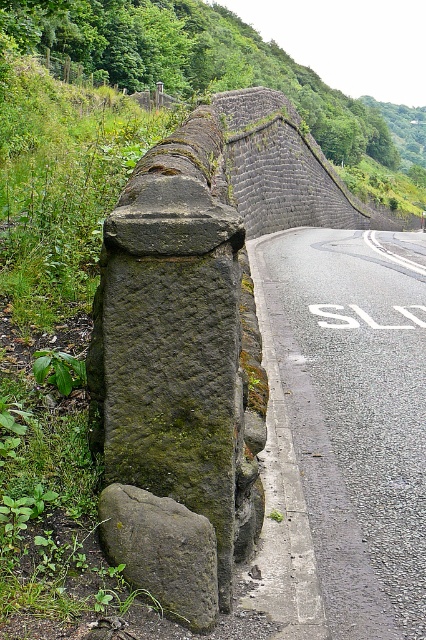
Which is behind, point (210, 51) or point (278, 637)?

The point (210, 51) is more distant.

Does green mossy stone wall at upper center have a greater width compared to gray concrete curb at lower center?

Indeed, green mossy stone wall at upper center has a greater width compared to gray concrete curb at lower center.

I want to click on green mossy stone wall at upper center, so click(187, 61).

Can you confirm if green mossy stone wall at upper center is positioned below green mossy rock at left?

No, green mossy stone wall at upper center is not below green mossy rock at left.

Can you confirm if green mossy stone wall at upper center is bigger than green mossy rock at left?

Correct, green mossy stone wall at upper center is larger in size than green mossy rock at left.

Locate an element on the screen. The height and width of the screenshot is (640, 426). green mossy stone wall at upper center is located at coordinates [187, 61].

Can you confirm if asphalt road at center is thinner than green mossy stone wall at upper center?

Correct, asphalt road at center's width is less than green mossy stone wall at upper center's.

Looking at this image, which is more to the right, asphalt road at center or green mossy stone wall at upper center?

Positioned to the right is green mossy stone wall at upper center.

Who is more distant from viewer, (400, 483) or (176, 65)?

Point (176, 65)

At what (x,y) coordinates should I click in order to perform the action: click on asphalt road at center. Please return your answer as a coordinate pair (x, y). The width and height of the screenshot is (426, 640). Looking at the image, I should click on (354, 420).